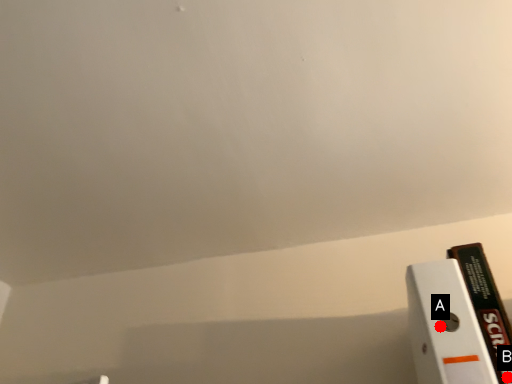
Question: Two points are circled on the image, labeled by A and B beside each circle. Which point is farther from the camera taking this photo?

Choices:
 (A) A is further
 (B) B is further

Answer: (B)